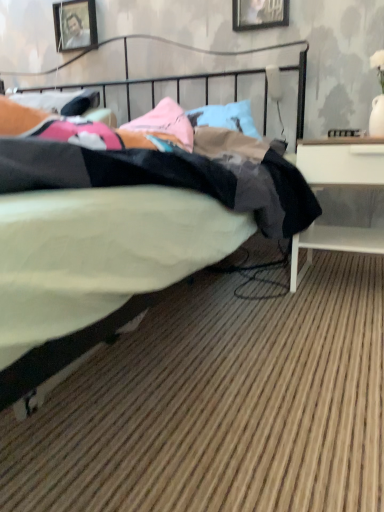
I want to click on free space in front of white matte desk at right, so click(334, 315).